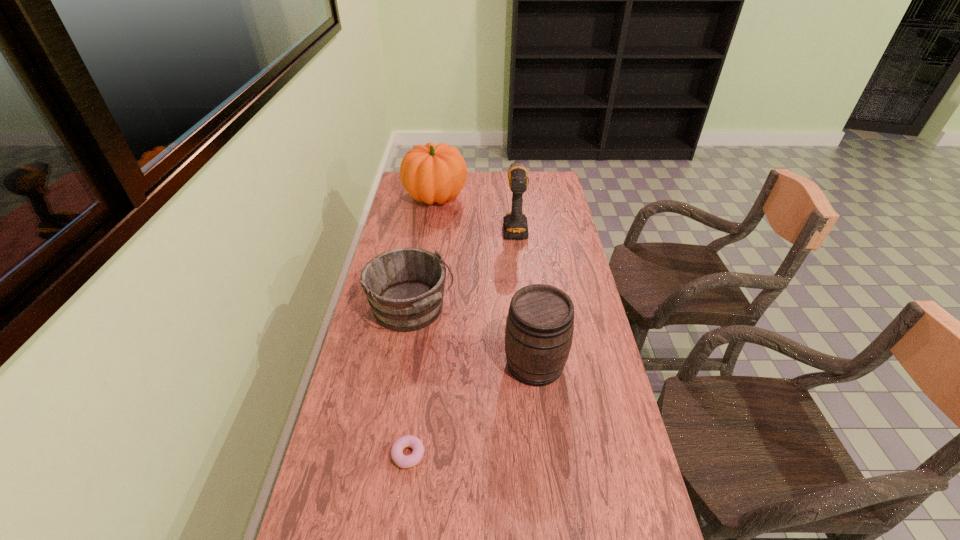
Choose which object is the nearest neighbor to the fourth tallest object. Please provide its 2D coordinates. Your answer should be formatted as a tuple, i.e. [(x, y)], where the tuple contains the x and y coordinates of a point satisfying the conditions above.

[(539, 329)]